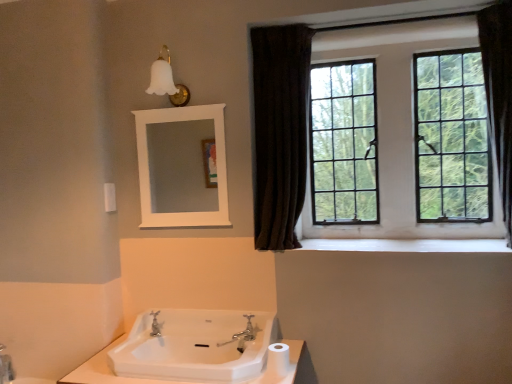
Question: From the image's perspective, is black glass window at upper right below white plastic towel bar at upper left?

Choices:
 (A) yes
 (B) no

Answer: (B)

Question: Is white plastic towel bar at upper left at the back of black glass window at upper right?

Choices:
 (A) no
 (B) yes

Answer: (A)

Question: Is black glass window at upper right wider than white plastic towel bar at upper left?

Choices:
 (A) yes
 (B) no

Answer: (A)

Question: Is black glass window at upper right positioned in front of white plastic towel bar at upper left?

Choices:
 (A) no
 (B) yes

Answer: (B)

Question: Is black glass window at upper right shorter than white plastic towel bar at upper left?

Choices:
 (A) no
 (B) yes

Answer: (A)

Question: Is black glass window at upper right not close to white plastic towel bar at upper left?

Choices:
 (A) no
 (B) yes

Answer: (B)

Question: Is brown fabric curtain at right in front of white plastic towel bar at upper left?

Choices:
 (A) no
 (B) yes

Answer: (B)

Question: Considering the relative sizes of brown fabric curtain at right and white plastic towel bar at upper left in the image provided, is brown fabric curtain at right taller than white plastic towel bar at upper left?

Choices:
 (A) no
 (B) yes

Answer: (B)

Question: Is brown fabric curtain at right at the right side of white plastic towel bar at upper left?

Choices:
 (A) no
 (B) yes

Answer: (B)

Question: Can you confirm if brown fabric curtain at right is smaller than white plastic towel bar at upper left?

Choices:
 (A) no
 (B) yes

Answer: (A)

Question: Can you confirm if brown fabric curtain at right is bigger than white plastic towel bar at upper left?

Choices:
 (A) yes
 (B) no

Answer: (A)

Question: Is there a large distance between brown fabric curtain at right and white plastic towel bar at upper left?

Choices:
 (A) yes
 (B) no

Answer: (A)

Question: Considering the relative sizes of white plastic towel bar at upper left and silver metallic faucet at center in the image provided, is white plastic towel bar at upper left smaller than silver metallic faucet at center?

Choices:
 (A) yes
 (B) no

Answer: (A)